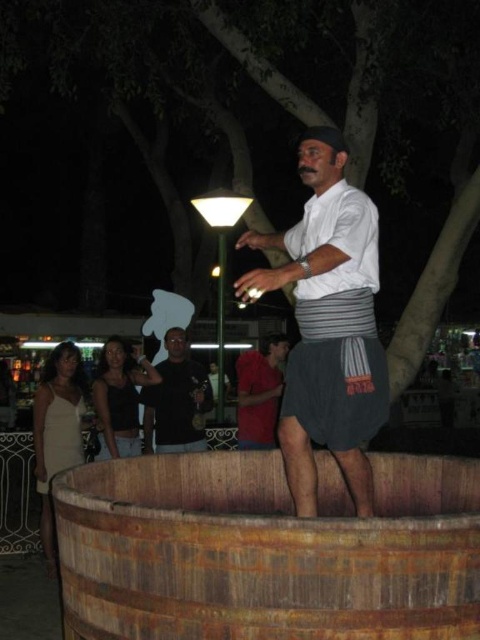
You are standing in the nighttime scene and want to walk from point A to point B. Point A is at coordinates point (274,365) and point B is at coordinates point (109,426). Which direction should you move to get closer to point B?

To move from point A at coordinates point (274,365) to point B at coordinates point (109,426), you should move downward and to the right since point B is located lower and further to the right compared to point A.

You are a photographer trying to capture the man in the white cotton shirt at center. The rusty wood barrel at lower center is blocking your view. Can you tell if the barrel is shorter than the shirt to see over it?

The rusty wood barrel at lower center has a lesser height compared to the white cotton shirt at center, so yes, you can see over the barrel to capture the man in the white cotton shirt at center.